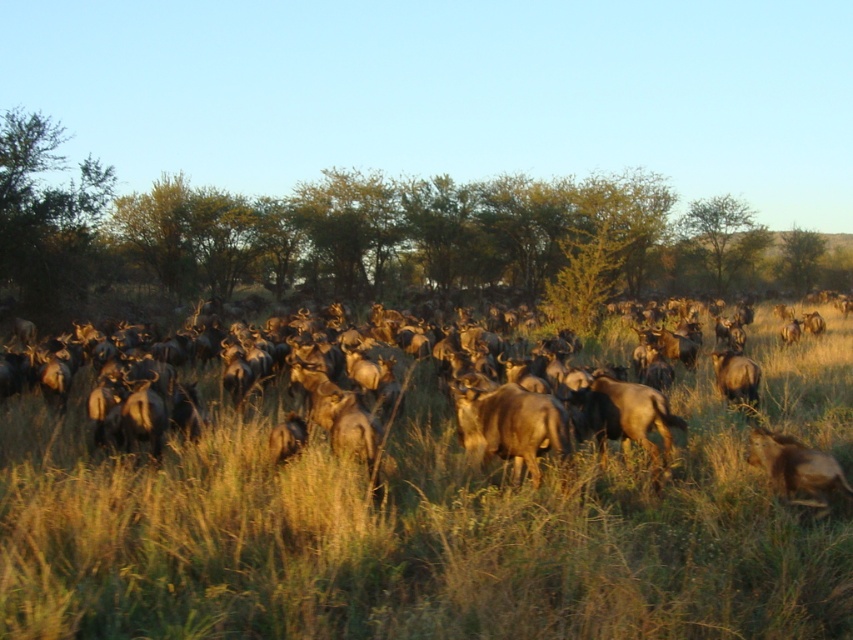
Can you confirm if brown furry wildebeest at center is thinner than brown furry buffalo at center-right?

No, brown furry wildebeest at center is not thinner than brown furry buffalo at center-right.

This screenshot has height=640, width=853. In order to click on brown furry wildebeest at center in this screenshot , I will do `click(511, 426)`.

Where is `brown furry wildebeest at center`? Image resolution: width=853 pixels, height=640 pixels. brown furry wildebeest at center is located at coordinates (511, 426).

Can you confirm if brown furry wildebeest at center is wider than brown furry antelope at lower right?

Yes, brown furry wildebeest at center is wider than brown furry antelope at lower right.

Which of these two, brown furry wildebeest at center or brown furry antelope at lower right, stands shorter?

brown furry antelope at lower right is shorter.

Between point (563, 419) and point (759, 452), which one is positioned behind?

Point (759, 452)

Locate an element on the screen. Image resolution: width=853 pixels, height=640 pixels. brown furry wildebeest at center is located at coordinates (511, 426).

Is brown grassy at center closer to camera compared to brown furry buffalo at center-right?

Yes, brown grassy at center is in front of brown furry buffalo at center-right.

Between point (683, 500) and point (752, 394), which one is positioned behind?

Positioned behind is point (752, 394).

The width and height of the screenshot is (853, 640). I want to click on brown grassy at center, so click(x=428, y=524).